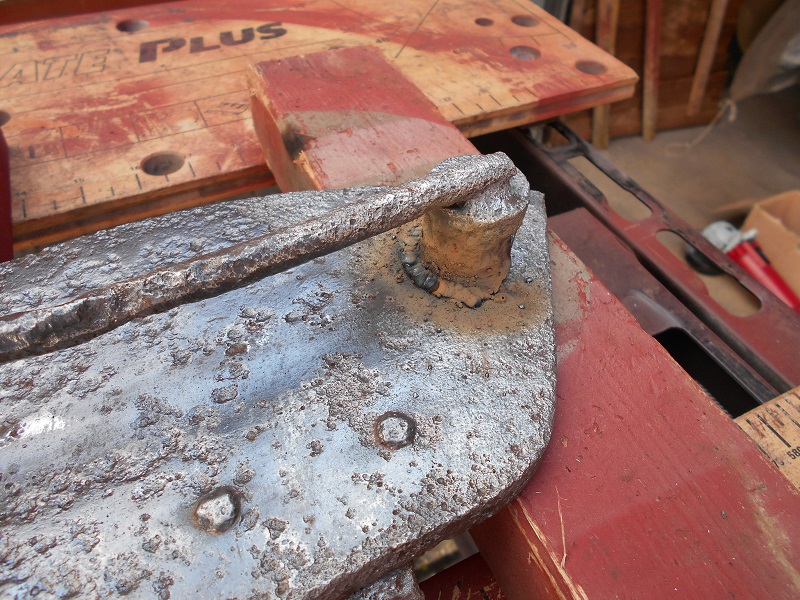
Locate an element on the screen. Image resolution: width=800 pixels, height=600 pixels. floor is located at coordinates (718, 185).